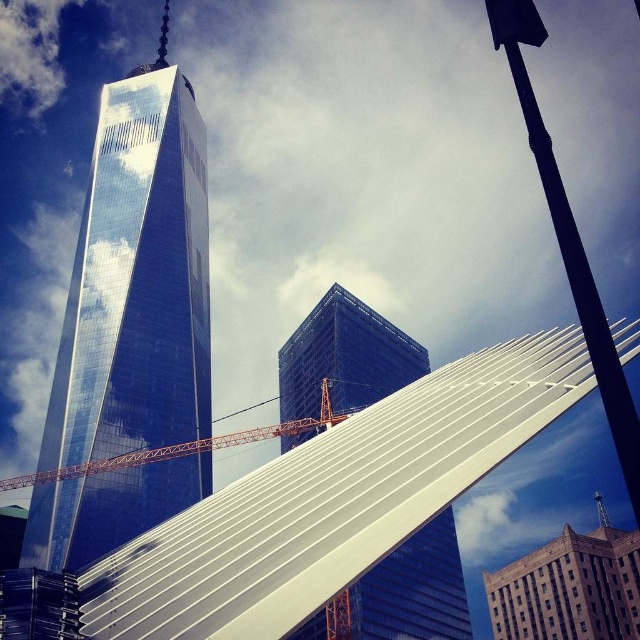
At what (x,y) coordinates should I click in order to perform the action: click on dark blue glass skyscraper at center. Please return your answer as a coordinate pair (x, y). Image resolution: width=640 pixels, height=640 pixels. Looking at the image, I should click on (344, 356).

Consider the image. How far apart are shiny glass skyscraper at center and dark blue glass skyscraper at center?

A distance of 137.68 feet exists between shiny glass skyscraper at center and dark blue glass skyscraper at center.

Who is positioned more to the left, shiny glass skyscraper at center or dark blue glass skyscraper at center?

From the viewer's perspective, shiny glass skyscraper at center appears more on the left side.

Is point (122, 429) closer to camera compared to point (362, 305)?

Yes.

I want to click on shiny glass skyscraper at center, so click(x=136, y=280).

Between shiny glass skyscraper at center and orange metallic crane at center, which one is positioned lower?

orange metallic crane at center

Does point (29, 532) lie behind point (195, 444)?

Yes, it is.

Where is `shiny glass skyscraper at center`? The image size is (640, 640). shiny glass skyscraper at center is located at coordinates click(x=136, y=280).